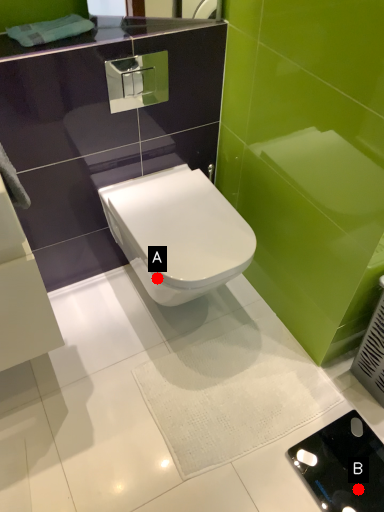
Question: Two points are circled on the image, labeled by A and B beside each circle. Which point appears farthest from the camera in this image?

Choices:
 (A) A is further
 (B) B is further

Answer: (A)